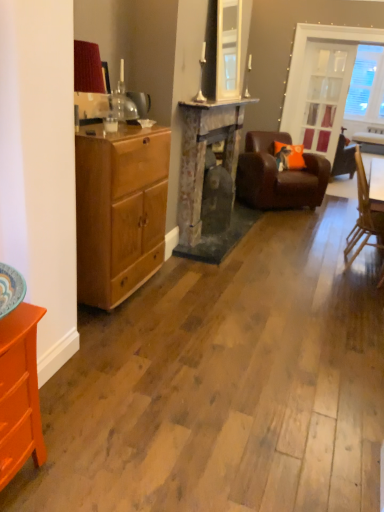
Question: Is rustic stone fireplace at center surrounded by wooden chair at right, the first chair from the front?

Choices:
 (A) no
 (B) yes

Answer: (A)

Question: Are wooden chair at right, the first chair from the front, and rustic stone fireplace at center beside each other?

Choices:
 (A) yes
 (B) no

Answer: (B)

Question: Considering the relative sizes of wooden chair at right, arranged as the 2th chair when viewed from the back, and rustic stone fireplace at center in the image provided, is wooden chair at right, arranged as the 2th chair when viewed from the back, shorter than rustic stone fireplace at center?

Choices:
 (A) no
 (B) yes

Answer: (B)

Question: Considering the relative positions of wooden chair at right, arranged as the 2th chair when viewed from the back, and rustic stone fireplace at center in the image provided, is wooden chair at right, arranged as the 2th chair when viewed from the back, behind rustic stone fireplace at center?

Choices:
 (A) yes
 (B) no

Answer: (A)

Question: From the image's perspective, is wooden chair at right, arranged as the 2th chair when viewed from the back, under rustic stone fireplace at center?

Choices:
 (A) yes
 (B) no

Answer: (A)

Question: Does wooden chair at right, the first chair from the front, have a greater width compared to rustic stone fireplace at center?

Choices:
 (A) no
 (B) yes

Answer: (B)

Question: From a real-world perspective, is wooden chair at right, the first chair from the front, located beneath orange fabric pillow at center?

Choices:
 (A) no
 (B) yes

Answer: (B)

Question: From the image's perspective, is wooden chair at right, the first chair from the front, below orange fabric pillow at center?

Choices:
 (A) no
 (B) yes

Answer: (B)

Question: Considering the relative sizes of wooden chair at right, arranged as the 2th chair when viewed from the back, and orange fabric pillow at center in the image provided, is wooden chair at right, arranged as the 2th chair when viewed from the back, thinner than orange fabric pillow at center?

Choices:
 (A) yes
 (B) no

Answer: (A)

Question: Is wooden chair at right, the first chair from the front, shorter than orange fabric pillow at center?

Choices:
 (A) yes
 (B) no

Answer: (B)

Question: Can you confirm if wooden chair at right, arranged as the 2th chair when viewed from the back, is smaller than orange fabric pillow at center?

Choices:
 (A) no
 (B) yes

Answer: (A)

Question: From a real-world perspective, is orange painted wood dresser at lower left positioned under wooden chair at right, arranged as the 2th chair when viewed from the back, based on gravity?

Choices:
 (A) yes
 (B) no

Answer: (A)